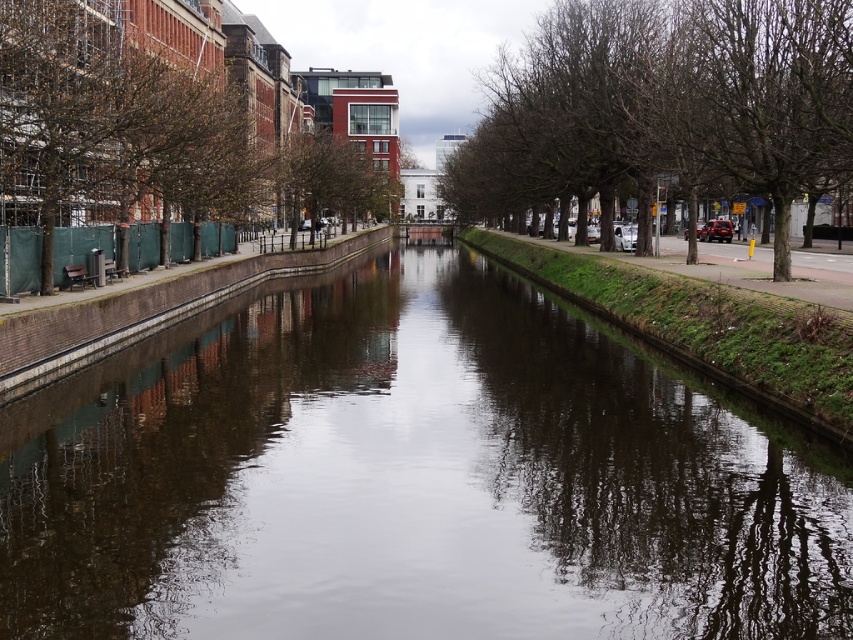
You are standing at the edge of the canal and want to take a photo of the brown leafy tree at left. If your camera has a maximum focus range of 20 meters, will it be able to capture the tree clearly?

The brown leafy tree at left is 22.11 meters away from viewer. Since the camera can only focus up to 20 meters, it won t be able to capture the tree clearly.